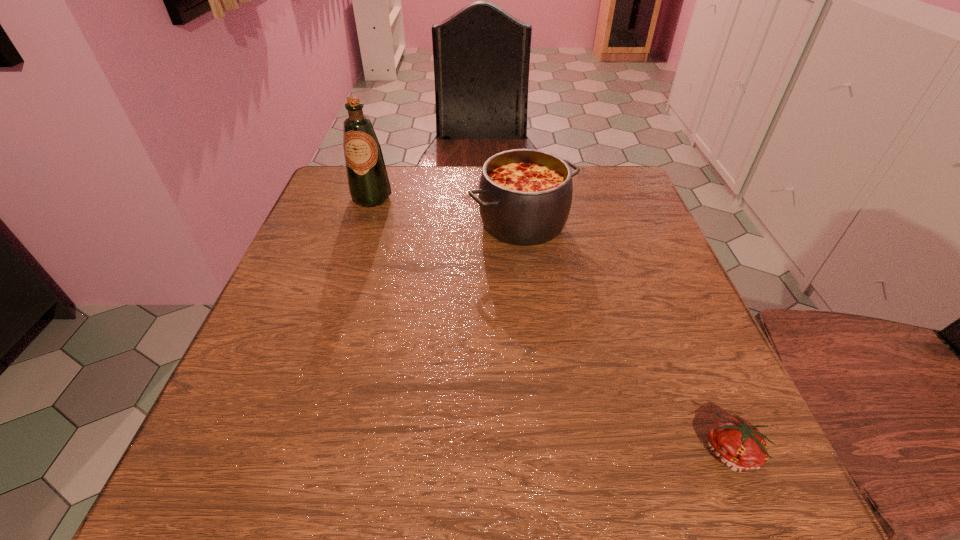
Locate an element on the screen. blank region between the leftmost object and the second object from left to right is located at coordinates (447, 210).

Identify the location of free space between the second object from left to right and the shortest object. (627, 338).

The height and width of the screenshot is (540, 960). Find the location of `object that can be found as the second closest to the tallest object`. object that can be found as the second closest to the tallest object is located at coordinates (736, 443).

I want to click on the second closest object to the olive oil, so click(736, 443).

Find the location of a particular element. vacant space that satisfies the following two spatial constraints: 1. on the front-facing side of the tallest object; 2. on the left side of the tomato is located at coordinates (288, 452).

In order to click on free region that satisfies the following two spatial constraints: 1. on the front-facing side of the nearest object; 2. on the right side of the leftmost object in this screenshot , I will do (x=288, y=452).

Find the location of a particular element. This screenshot has height=540, width=960. free location that satisfies the following two spatial constraints: 1. on the front-facing side of the tomato; 2. on the right side of the tallest object is located at coordinates (288, 452).

Find the location of a particular element. This screenshot has height=540, width=960. vacant space that satisfies the following two spatial constraints: 1. on the front-facing side of the olive oil; 2. on the right side of the casserole is located at coordinates click(x=363, y=223).

Locate an element on the screen. This screenshot has height=540, width=960. vacant space that satisfies the following two spatial constraints: 1. on the front-facing side of the shortest object; 2. on the left side of the tallest object is located at coordinates (288, 452).

This screenshot has width=960, height=540. I want to click on free location that satisfies the following two spatial constraints: 1. on the front-facing side of the olive oil; 2. on the right side of the shortest object, so click(x=288, y=452).